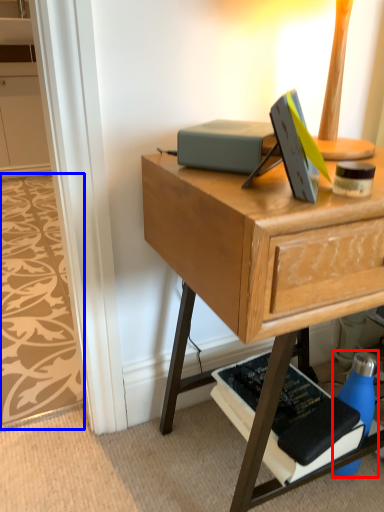
Question: Which object is further to the camera taking this photo, bottle (highlighted by a red box) or pattern (highlighted by a blue box)?

Choices:
 (A) bottle
 (B) pattern

Answer: (B)